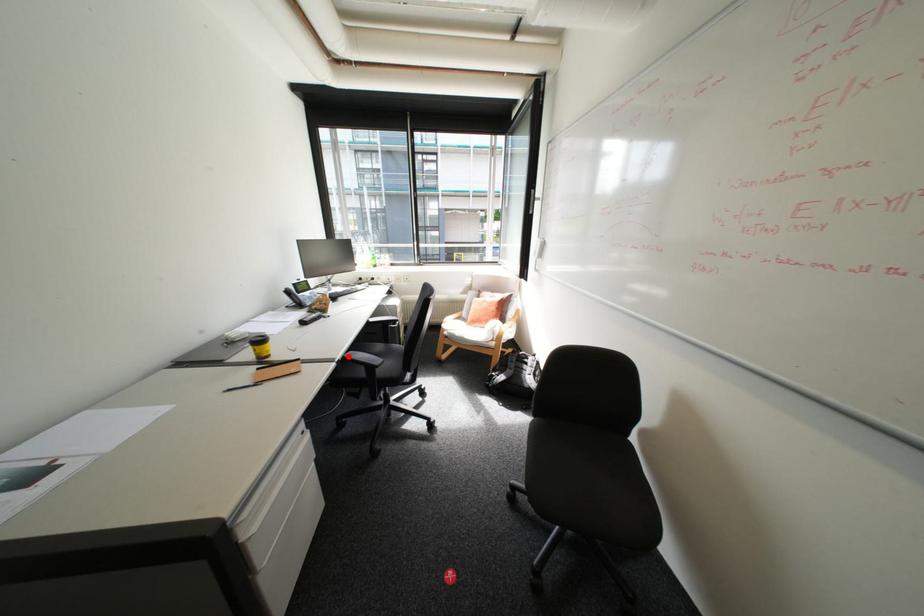
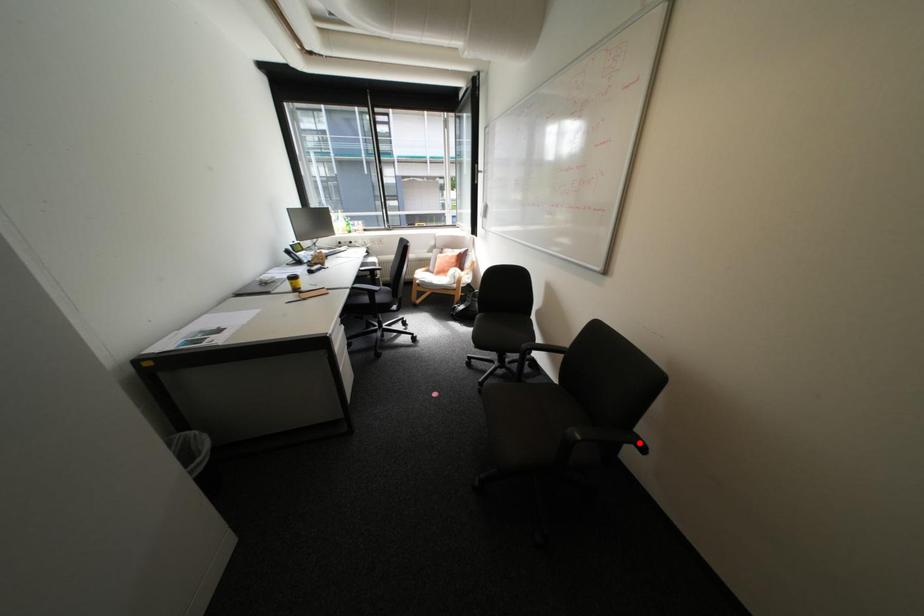
I am providing you with two images of the same scene from different viewpoints. A red point is marked on the first image and another point is marked on the second image. Do the highlighted points in image1 and image2 indicate the same real-world spot?

No